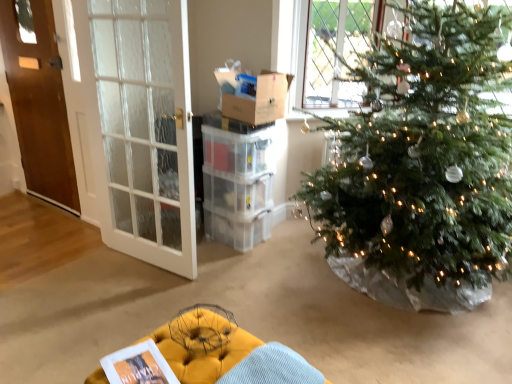
Question: Is yellow tufted ottoman at lower center inside the boundaries of cardboard box at upper center, or outside?

Choices:
 (A) outside
 (B) inside

Answer: (A)

Question: Visually, is yellow tufted ottoman at lower center positioned to the left or to the right of cardboard box at upper center?

Choices:
 (A) left
 (B) right

Answer: (A)

Question: Which object is positioned closest to the brown wooden door at left, which appears as the 2th door when viewed from the right?

Choices:
 (A) cardboard box at upper center
 (B) clear plastic crate at center
 (C) yellow tufted ottoman at lower center
 (D) white glass door at left, positioned as the first door in right-to-left order

Answer: (D)

Question: Based on their relative distances, which object is farther from the cardboard box at upper center?

Choices:
 (A) clear plastic crate at center
 (B) yellow tufted ottoman at lower center
 (C) brown wooden door at left, which is the 2th door from front to back
 (D) white glass door at left, which is counted as the 2th door, starting from the left

Answer: (C)